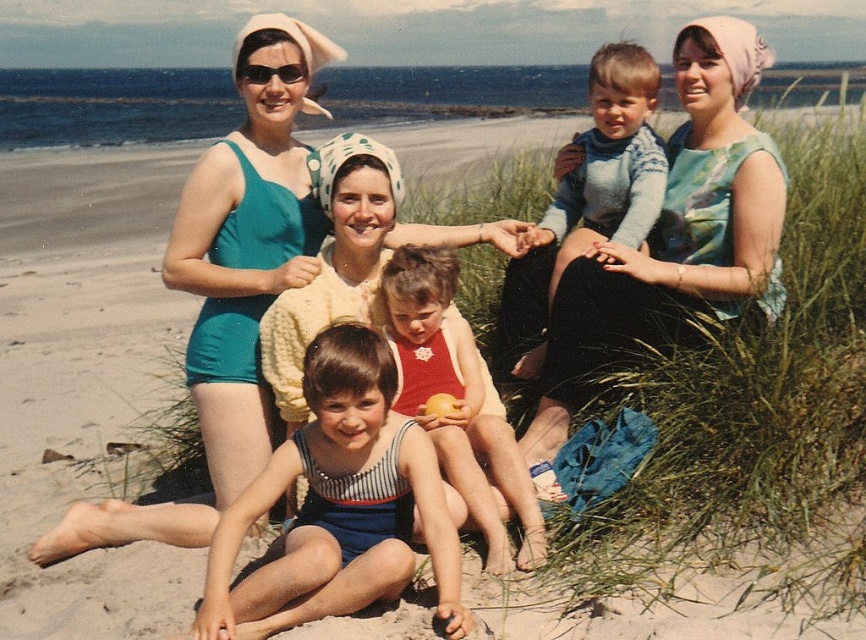
Question: Which point is farther to the camera?

Choices:
 (A) striped fabric swimsuit at center
 (B) knitted sweater at center
 (C) floral dress at center
 (D) red swimsuit at center

Answer: (B)

Question: Considering the relative positions of red swimsuit at center and knitted sweater at center in the image provided, where is red swimsuit at center located with respect to knitted sweater at center?

Choices:
 (A) above
 (B) below

Answer: (B)

Question: Is floral dress at center wider than knitted sweater at center?

Choices:
 (A) no
 (B) yes

Answer: (B)

Question: Considering the relative positions of floral dress at center and red swimsuit at center in the image provided, where is floral dress at center located with respect to red swimsuit at center?

Choices:
 (A) below
 (B) above

Answer: (B)

Question: Which point is farther to the camera?

Choices:
 (A) (580, 216)
 (B) (419, 388)

Answer: (A)

Question: Which object is farther from the camera taking this photo?

Choices:
 (A) floral dress at center
 (B) knitted sweater at center
 (C) striped fabric swimsuit at center

Answer: (B)